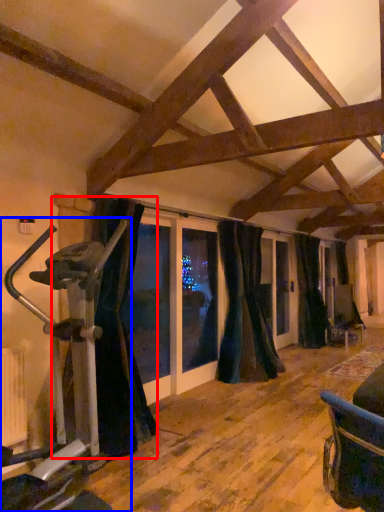
Question: Which object appears farthest to the camera in this image, curtain (highlighted by a red box) or stationary bicycle (highlighted by a blue box)?

Choices:
 (A) curtain
 (B) stationary bicycle

Answer: (A)